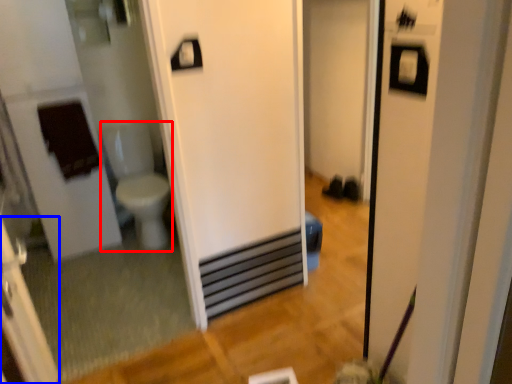
Question: Which of the following is the farthest to the observer, toilet bowl (highlighted by a red box) or screen door (highlighted by a blue box)?

Choices:
 (A) toilet bowl
 (B) screen door

Answer: (A)